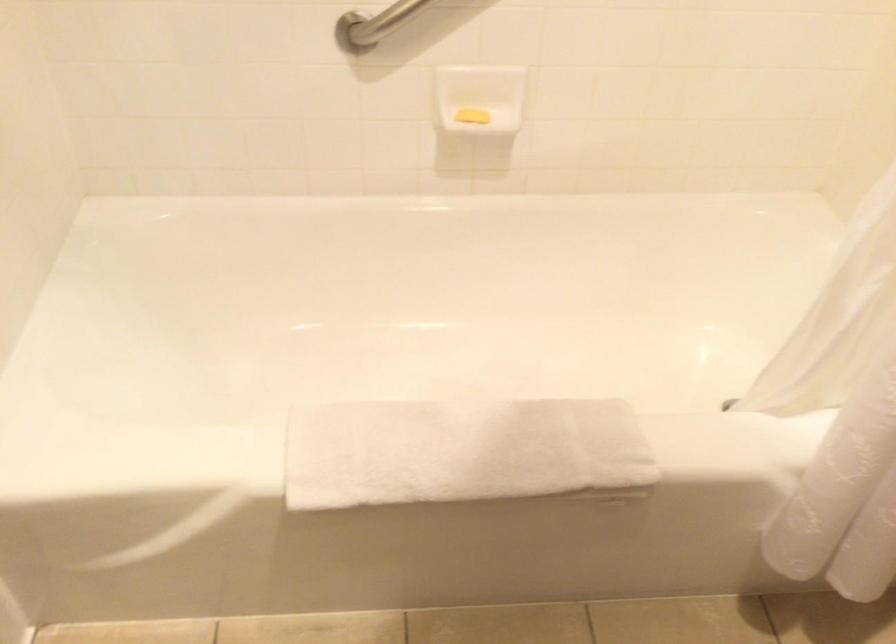
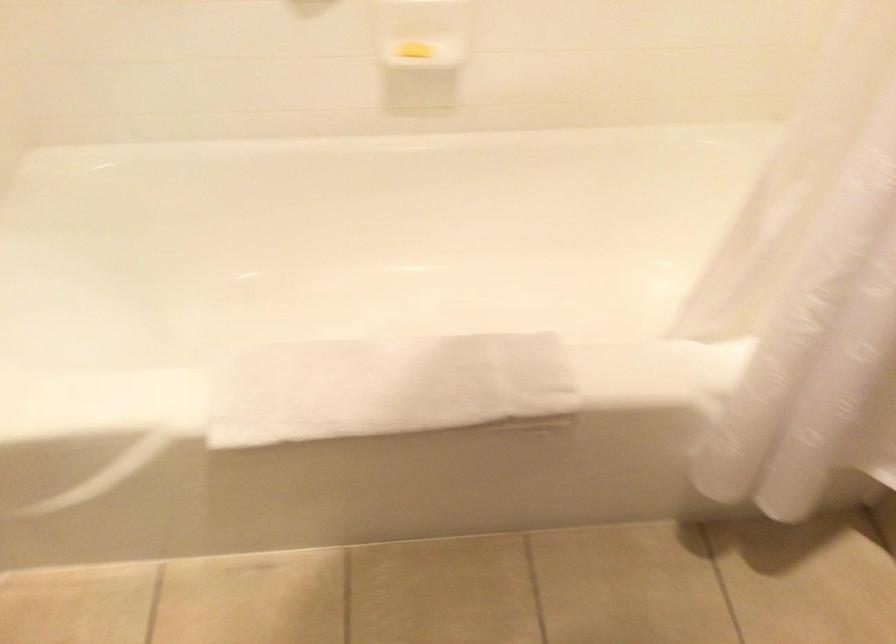
Question: Based on the continuous images, in which direction is the camera rotating? Reply with the corresponding letter.

Choices:
 (A) Left
 (B) Right
 (C) Up
 (D) Down

Answer: (D)